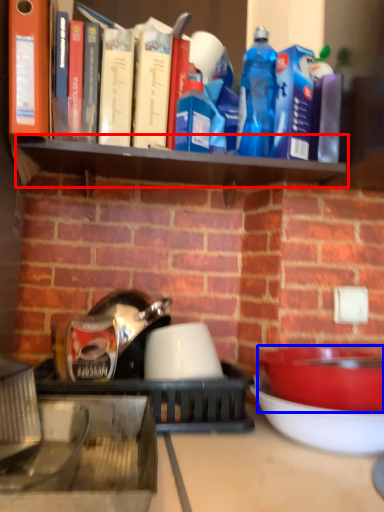
Question: Which object is further to the camera taking this photo, shelf (highlighted by a red box) or bowl (highlighted by a blue box)?

Choices:
 (A) shelf
 (B) bowl

Answer: (A)